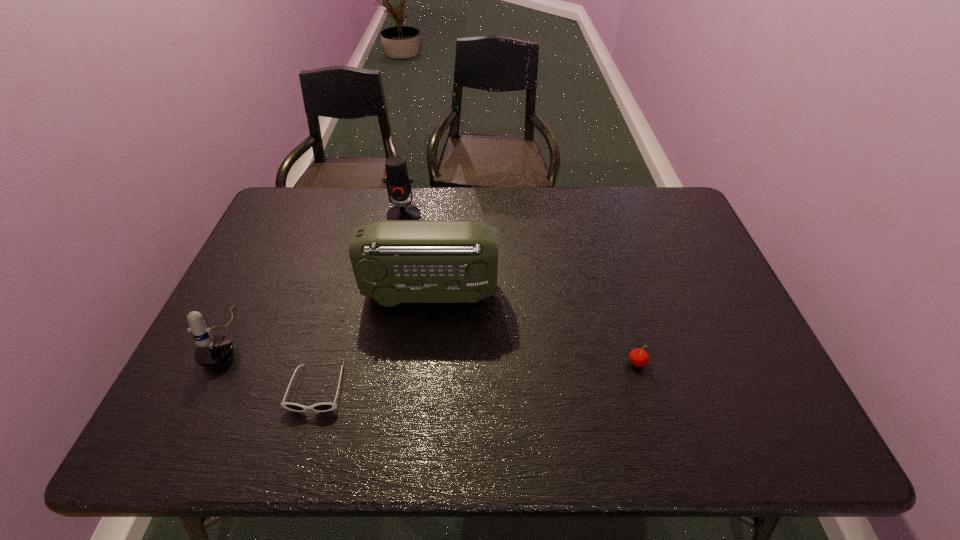
This screenshot has width=960, height=540. In order to click on vacant region at the far right corner in this screenshot , I will do `click(678, 216)`.

Locate an element on the screen. vacant region at the near right corner of the desktop is located at coordinates (781, 429).

Where is `vacant space that's between the radio_receiver and the sunglasses`? The image size is (960, 540). vacant space that's between the radio_receiver and the sunglasses is located at coordinates (374, 341).

The width and height of the screenshot is (960, 540). Find the location of `vacant region between the shorter microphone and the farther microphone`. vacant region between the shorter microphone and the farther microphone is located at coordinates (317, 276).

Locate an element on the screen. The image size is (960, 540). free spot between the third shortest object and the radio_receiver is located at coordinates (329, 315).

Where is `vacant space that's between the shortest object and the left microphone`? Image resolution: width=960 pixels, height=540 pixels. vacant space that's between the shortest object and the left microphone is located at coordinates (274, 363).

In order to click on unoccupied area between the shortest object and the radio_receiver in this screenshot , I will do `click(374, 341)`.

Where is `vacant space that's between the radio_receiver and the rightmost object`? vacant space that's between the radio_receiver and the rightmost object is located at coordinates (534, 327).

This screenshot has width=960, height=540. Find the location of `free space between the radio_receiver and the cherry`. free space between the radio_receiver and the cherry is located at coordinates (534, 327).

Locate an element on the screen. The image size is (960, 540). free spot between the radio_receiver and the sunglasses is located at coordinates (374, 341).